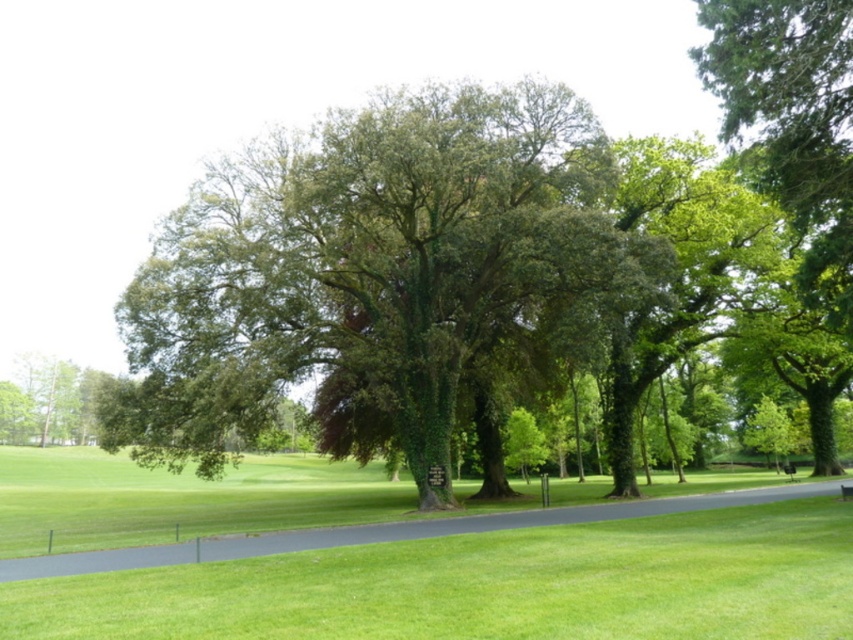
Which is below, black asphalt path at center or wooden park bench at center?

wooden park bench at center

Does black asphalt path at center appear on the right side of wooden park bench at center?

Incorrect, black asphalt path at center is not on the right side of wooden park bench at center.

The image size is (853, 640). In order to click on black asphalt path at center in this screenshot , I will do `click(387, 531)`.

Does green leafy tree at upper right appear on the right side of wooden park bench at center?

Yes, green leafy tree at upper right is to the right of wooden park bench at center.

Between point (788, 96) and point (850, 499), which one is positioned in front?

Point (788, 96) is in front.

Locate an element on the screen. The image size is (853, 640). green leafy tree at upper right is located at coordinates (793, 124).

Is green leafy tree at center shorter than wooden park bench at center?

No.

Between point (125, 321) and point (848, 490), which one is positioned in front?

Point (848, 490) is in front.

Identify the location of green leafy tree at center. (368, 269).